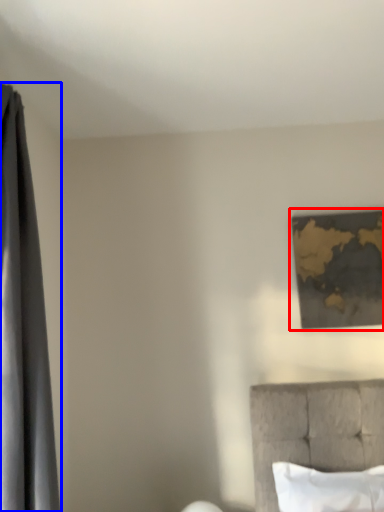
Question: Which of the following is the farthest to the observer, picture frame (highlighted by a red box) or curtain (highlighted by a blue box)?

Choices:
 (A) picture frame
 (B) curtain

Answer: (A)